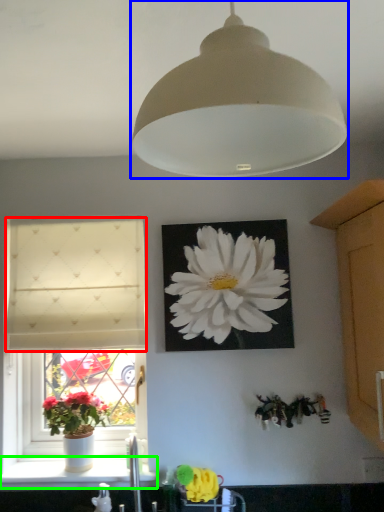
Question: Estimate the real-world distances between objects in this image. Which object is closer to curtain (highlighted by a red box), lamp (highlighted by a blue box) or window sill (highlighted by a green box)?

Choices:
 (A) lamp
 (B) window sill

Answer: (B)